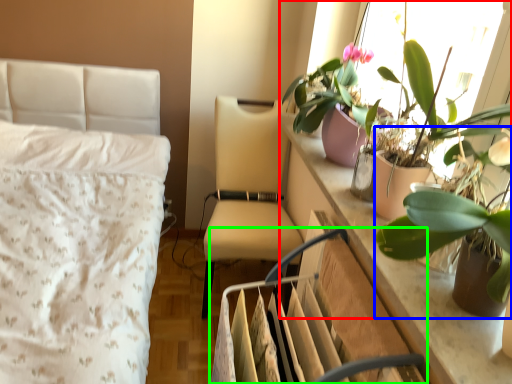
Question: Which is farther away from houseplant (highlighted by a red box)? houseplant (highlighted by a blue box) or swivel chair (highlighted by a green box)?

Choices:
 (A) houseplant
 (B) swivel chair

Answer: (B)